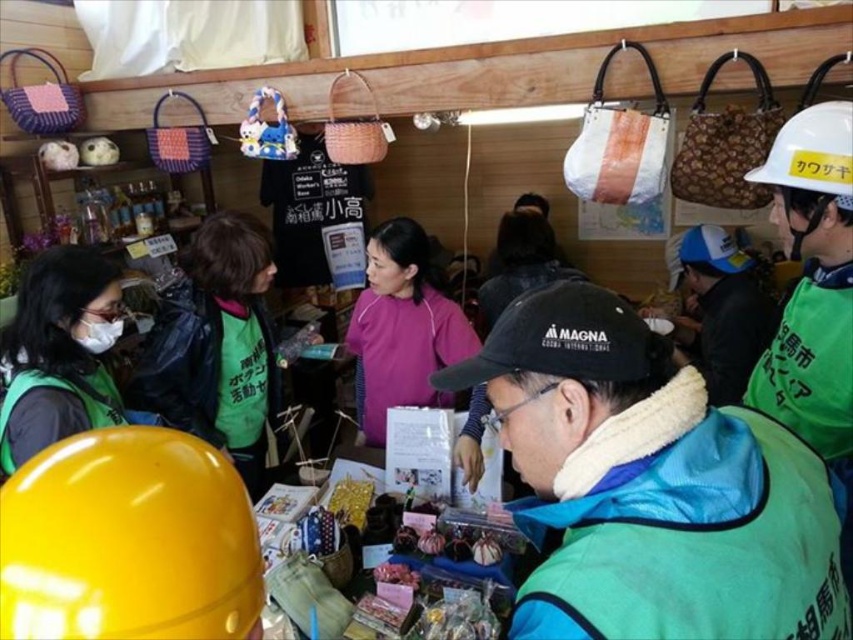
You are a customer at the market and want to pick up both the green fabric vest at left and the pink matte shirt at center. If your arms can reach 18 inches, can you grab both items at the same time?

The distance between the green fabric vest at left and the pink matte shirt at center is 18.67 inches. Since your arms can only reach 18 inches, you cannot grab both items simultaneously.

You are a customer at this market and want to see the pink matte shirt at center better. The green fabric vest at left is blocking your view. Can you move around to the right side to get a better look?

The pink matte shirt at center is behind the green fabric vest at left, so moving to the right side might allow you to see around the green fabric vest at left and get a better view of the pink matte shirt at center.